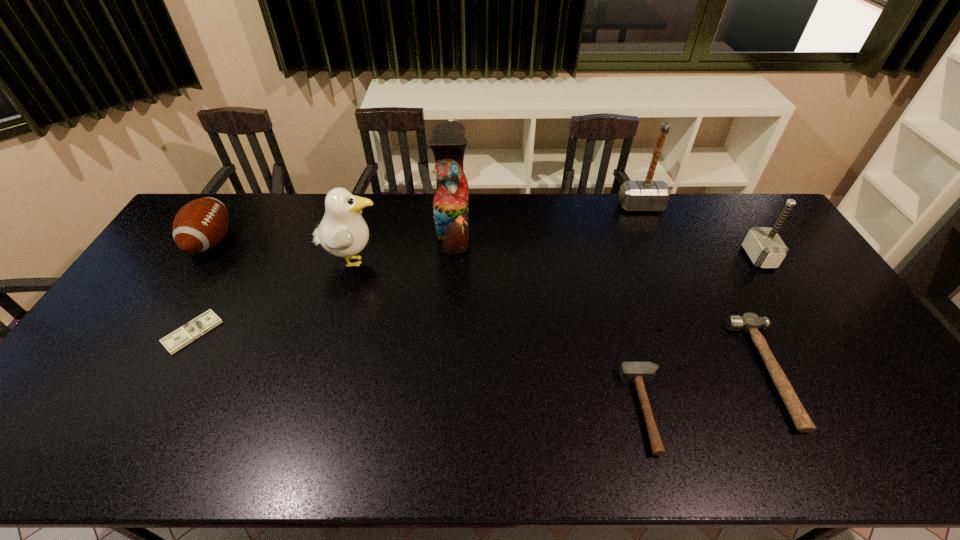
Locate an element on the screen. free region that satisfies the following two spatial constraints: 1. for striking with the head of the third nearest hammer; 2. on the front side of the shortest object is located at coordinates (806, 332).

At what (x,y) coordinates should I click in order to perform the action: click on free space that satisfies the following two spatial constraints: 1. on the beak of the third tallest object; 2. on the front side of the dollar. Please return your answer as a coordinate pair (x, y). This screenshot has height=540, width=960. Looking at the image, I should click on (330, 332).

Where is `vacant region that satisfies the following two spatial constraints: 1. on the striking surface of the farthest hammer; 2. on the beak of the third object from left to right`? This screenshot has height=540, width=960. vacant region that satisfies the following two spatial constraints: 1. on the striking surface of the farthest hammer; 2. on the beak of the third object from left to right is located at coordinates (663, 261).

The image size is (960, 540). In order to click on free location that satisfies the following two spatial constraints: 1. on the striking surface of the third hammer from right to left; 2. on the beak of the third object from left to right in this screenshot , I will do `click(663, 261)`.

This screenshot has height=540, width=960. In order to click on vacant region that satisfies the following two spatial constraints: 1. on the striking surface of the farthest hammer; 2. on the beak of the sixth object from right to left in this screenshot , I will do `click(663, 261)`.

You are a GUI agent. You are given a task and a screenshot of the screen. Output one action in this format:
    pyautogui.click(x=<x>, y=<y>)
    Task: Click on the free space that satisfies the following two spatial constraints: 1. on the striking surface of the sixth object from left to right; 2. at the face of the parrot
    The width and height of the screenshot is (960, 540).
    Given the screenshot: What is the action you would take?
    pyautogui.click(x=651, y=232)

The height and width of the screenshot is (540, 960). Find the location of `free space that satisfies the following two spatial constraints: 1. on the laces of the shortest object; 2. on the right side of the football`. free space that satisfies the following two spatial constraints: 1. on the laces of the shortest object; 2. on the right side of the football is located at coordinates (154, 332).

Locate an element on the screen. free space that satisfies the following two spatial constraints: 1. on the striking surface of the tallest hammer; 2. on the laces of the football is located at coordinates (655, 241).